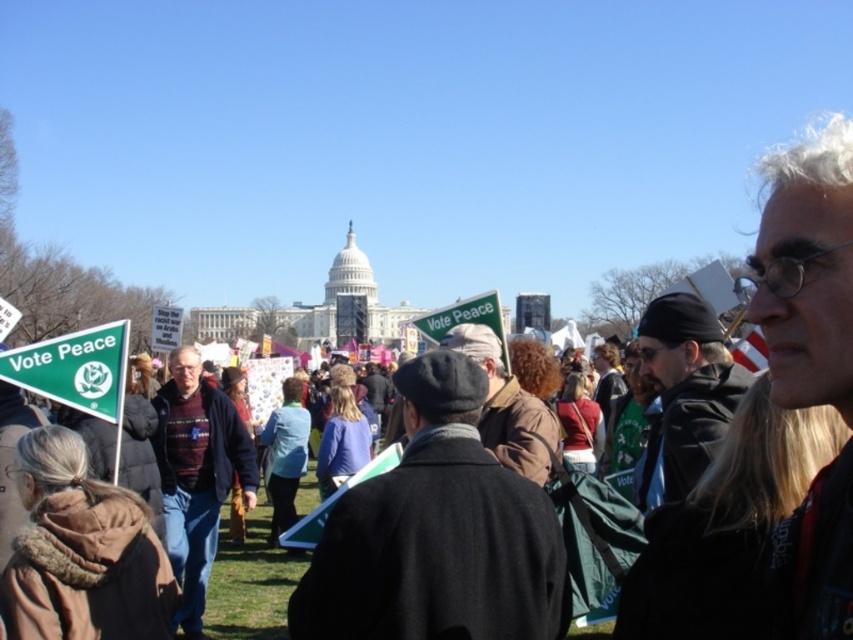
You are a photographer standing at the edge of the crowd. You want to take a photo of the dark gray wool coat at center. What coordinates should you aim your camera at?

You should aim your camera at coordinates point [437,532] to capture the dark gray wool coat at center.